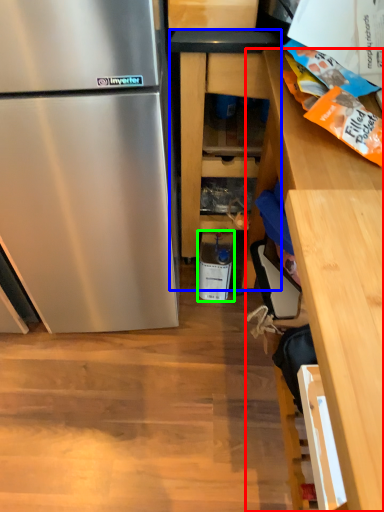
Question: Considering the real-world distances, which object is farthest from cabinetry (highlighted by a red box)? cabinetry (highlighted by a blue box) or appliance (highlighted by a green box)?

Choices:
 (A) cabinetry
 (B) appliance

Answer: (B)